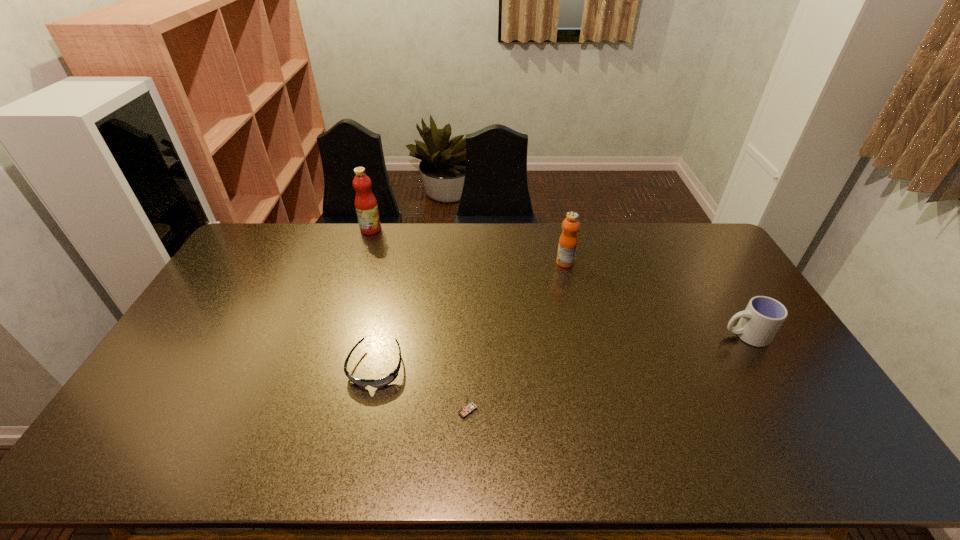
You are a GUI agent. You are given a task and a screenshot of the screen. Output one action in this format:
    pyautogui.click(x=<x>, y=<y>)
    Task: Click on the vacant space that is in between the nearer fruit juice and the rightmost object
    The width and height of the screenshot is (960, 540).
    Given the screenshot: What is the action you would take?
    pyautogui.click(x=655, y=299)

Locate an element on the screen. The height and width of the screenshot is (540, 960). empty space between the rightmost object and the nearest object is located at coordinates (607, 373).

Image resolution: width=960 pixels, height=540 pixels. I want to click on object that is the third closest to the sunglasses, so click(x=567, y=246).

Image resolution: width=960 pixels, height=540 pixels. In order to click on object that stands as the third closest to the nearest object in this screenshot , I will do `click(760, 321)`.

Identify the location of free space in the image that satisfies the following two spatial constraints: 1. with the handle on the side of the rightmost object; 2. on the front side of the fourth tallest object. The width and height of the screenshot is (960, 540). (791, 411).

Locate an element on the screen. The height and width of the screenshot is (540, 960). free space in the image that satisfies the following two spatial constraints: 1. with the handle on the side of the cup; 2. on the lenses of the sunglasses is located at coordinates (765, 367).

This screenshot has width=960, height=540. Find the location of `blank space that satisfies the following two spatial constraints: 1. on the front label of the matchbox; 2. on the left side of the leftmost object`. blank space that satisfies the following two spatial constraints: 1. on the front label of the matchbox; 2. on the left side of the leftmost object is located at coordinates (312, 411).

Locate an element on the screen. Image resolution: width=960 pixels, height=540 pixels. free space that satisfies the following two spatial constraints: 1. on the back side of the third object from left to right; 2. on the front label of the tallest object is located at coordinates (472, 229).

The width and height of the screenshot is (960, 540). In order to click on vacant space that satisfies the following two spatial constraints: 1. on the lenses of the fourth object from right to left; 2. on the right side of the fourth tallest object in this screenshot , I will do `click(367, 411)`.

The width and height of the screenshot is (960, 540). I want to click on free space that satisfies the following two spatial constraints: 1. on the front label of the third object from right to left; 2. on the left side of the leftmost object, so click(312, 411).